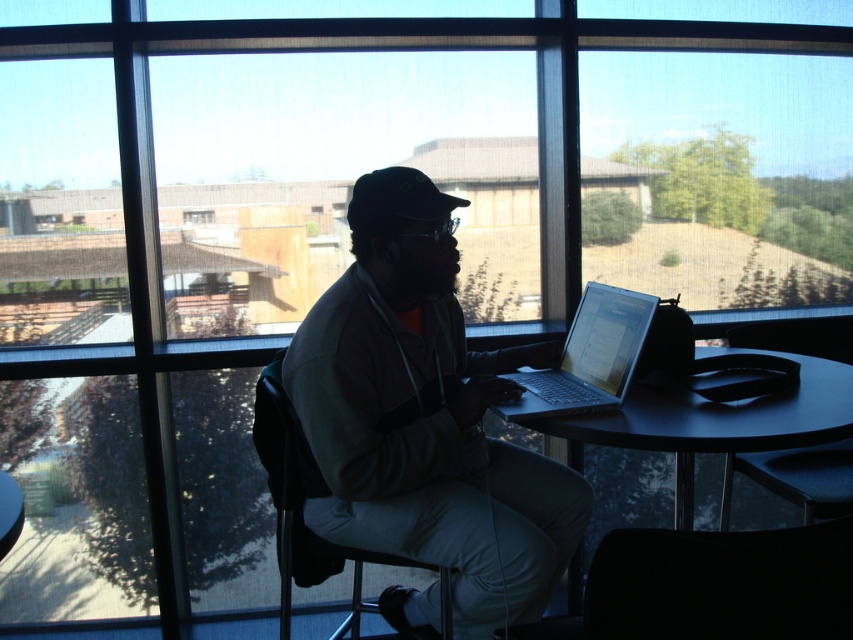
Who is more distant from viewer, (547, 422) or (212, 211)?

Point (212, 211)

Who is higher up, black plastic table at center or clear glass window at center?

clear glass window at center

The image size is (853, 640). What do you see at coordinates (715, 420) in the screenshot?
I see `black plastic table at center` at bounding box center [715, 420].

You are a GUI agent. You are given a task and a screenshot of the screen. Output one action in this format:
    pyautogui.click(x=<x>, y=<y>)
    Task: Click on the black plastic table at center
    
    Given the screenshot: What is the action you would take?
    pyautogui.click(x=715, y=420)

Does point (352, 355) come closer to viewer compared to point (202, 216)?

Yes, point (352, 355) is closer to viewer.

Who is taller, dark gray hoodie at center or clear glass window at center?

dark gray hoodie at center is taller.

Is point (378, 428) positioned in front of point (206, 216)?

Yes, it is in front of point (206, 216).

Find the location of a particular element. The image size is (853, 640). dark gray hoodie at center is located at coordinates (425, 417).

Is dark gray hoodie at center further to camera compared to silver metallic laptop at center?

No, dark gray hoodie at center is closer to the viewer.

Is dark gray hoodie at center shorter than silver metallic laptop at center?

Incorrect, dark gray hoodie at center's height does not fall short of silver metallic laptop at center's.

Where is `dark gray hoodie at center`? dark gray hoodie at center is located at coordinates [x=425, y=417].